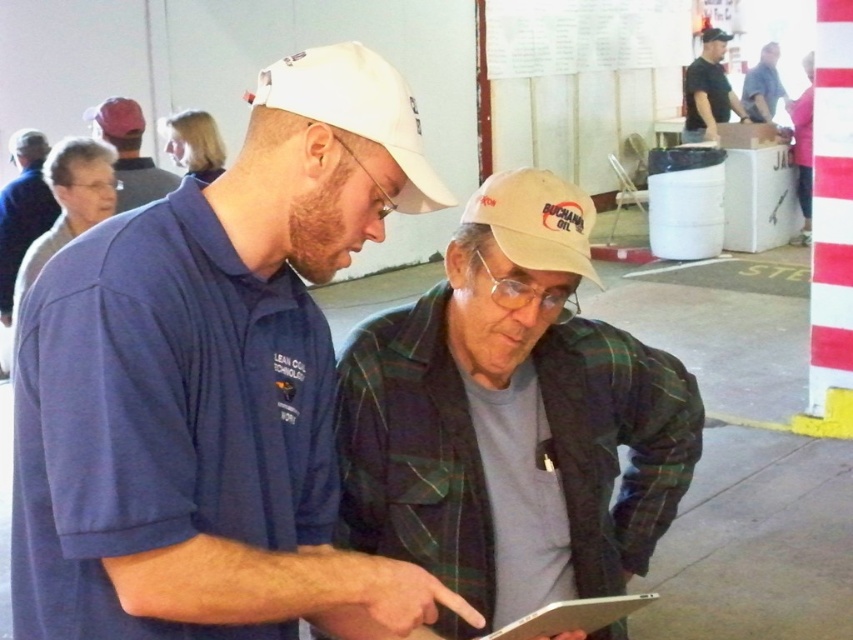
You are designing a poster for an event and need to place two elements based on their sizes. The elements are the matte gray cap at upper left and the blue plaid shirt at upper right. According to the image, which element should you make larger in your design?

The matte gray cap at upper left should be made larger in the design since it might be wider than the blue plaid shirt at upper right according to the image.

You are standing in a room and see the matte gray cap at upper left and the blue plaid shirt at upper right. Which object is positioned more to the left side of the room?

The matte gray cap at upper left is positioned more to the left side of the room than the blue plaid shirt at upper right.

You are an observer in the scene. You notice the matte blue shirt at center and the matte gray cap at upper left. Which object is positioned lower in the image?

→ The matte blue shirt at center is located below the matte gray cap at upper left, so it is positioned lower in the image.